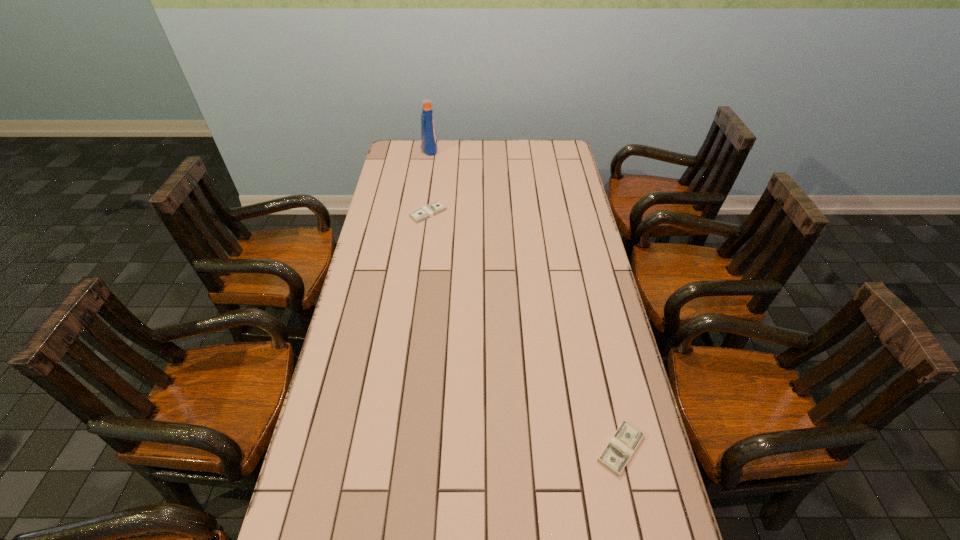
Image resolution: width=960 pixels, height=540 pixels. What are the coordinates of `detergent` in the screenshot? It's located at coord(428,136).

Image resolution: width=960 pixels, height=540 pixels. In order to click on the tallest object in this screenshot , I will do `click(428, 136)`.

I want to click on the farther dollar, so click(x=432, y=209).

Locate an element on the screen. This screenshot has width=960, height=540. the left dollar is located at coordinates (432, 209).

Find the location of a particular element. The width and height of the screenshot is (960, 540). the right dollar is located at coordinates (623, 443).

What are the coordinates of `the nearest object` in the screenshot? It's located at (623, 443).

Find the location of a particular element. vacant space located 0.390m on the label of the farthest object is located at coordinates (519, 148).

Locate an element on the screen. This screenshot has width=960, height=540. vacant space located on the front of the second nearest object is located at coordinates (422, 257).

The image size is (960, 540). What are the coordinates of `vacant space located on the back of the nearest object` in the screenshot? It's located at (610, 401).

Where is `object located in the far edge section of the desktop`? object located in the far edge section of the desktop is located at coordinates (428, 136).